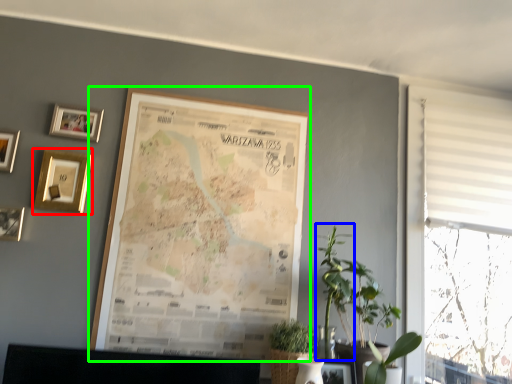
Question: Considering the real-world distances, which object is closest to picture frame (highlighted by a red box)? plant (highlighted by a blue box) or picture frame (highlighted by a green box).

Choices:
 (A) plant
 (B) picture frame

Answer: (B)